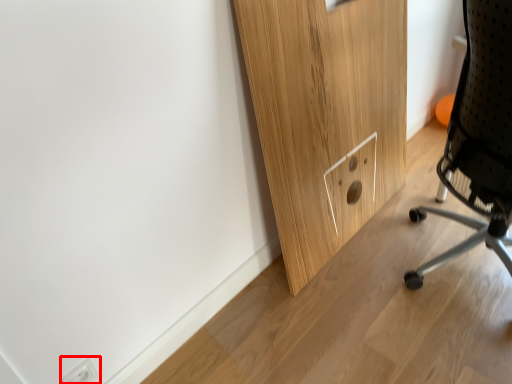
Question: From the image's perspective, where is electric outlet (annotated by the red box) located in relation to chair in the image?

Choices:
 (A) below
 (B) above

Answer: (A)